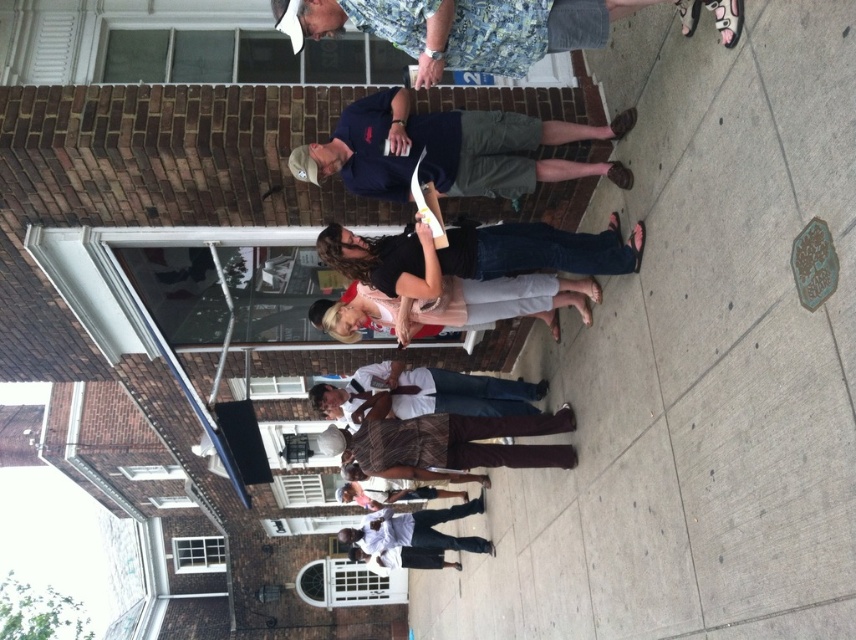
Between dark blue shirt at center and white shirt at center, which one has more height?

Standing taller between the two is dark blue shirt at center.

Is dark blue shirt at center wider than white shirt at center?

No, dark blue shirt at center is not wider than white shirt at center.

Does point (482, 189) lie in front of point (417, 385)?

That is True.

You are a GUI agent. You are given a task and a screenshot of the screen. Output one action in this format:
    pyautogui.click(x=<x>, y=<y>)
    Task: Click on the dark blue shirt at center
    
    Given the screenshot: What is the action you would take?
    pyautogui.click(x=449, y=148)

Which is more to the left, brown plaid pants at center or white cotton shirt at center?

From the viewer's perspective, white cotton shirt at center appears more on the left side.

Is point (352, 448) farther from camera compared to point (424, 522)?

No, it is in front of (424, 522).

Who is more distant from viewer, (518, 435) or (419, 516)?

The point (419, 516) is behind.

In order to click on brown plaid pants at center in this screenshot , I will do `click(449, 442)`.

Is light pink sheer blouse at center positioned before white shirt at center?

Yes, light pink sheer blouse at center is closer to the viewer.

Does light pink sheer blouse at center have a lesser height compared to white shirt at center?

Correct, light pink sheer blouse at center is not as tall as white shirt at center.

Is point (557, 289) positioned in front of point (489, 413)?

Yes.

You are a GUI agent. You are given a task and a screenshot of the screen. Output one action in this format:
    pyautogui.click(x=<x>, y=<y>)
    Task: Click on the light pink sheer blouse at center
    
    Given the screenshot: What is the action you would take?
    pyautogui.click(x=502, y=301)